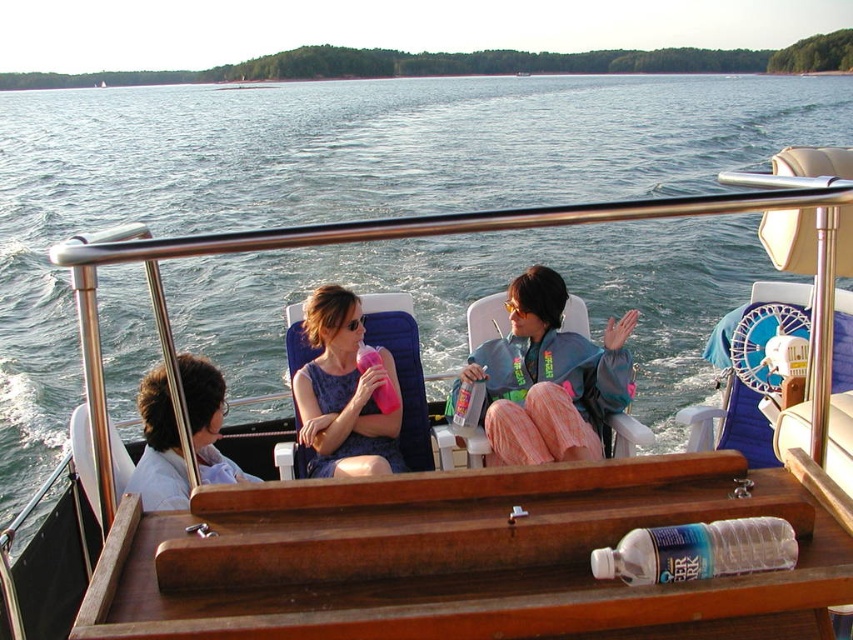
Can you confirm if pink fabric pants at center is taller than light blue shirt at center?

Yes, pink fabric pants at center is taller than light blue shirt at center.

Is pink fabric pants at center above light blue shirt at center?

Yes.

Is point (590, 449) less distant than point (201, 444)?

No, it is behind (201, 444).

This screenshot has width=853, height=640. I want to click on pink fabric pants at center, so click(x=547, y=378).

Can you confirm if matte purple dress at center is positioned to the right of light blue shirt at center?

Correct, you'll find matte purple dress at center to the right of light blue shirt at center.

Is the position of matte purple dress at center more distant than that of light blue shirt at center?

That is True.

Does point (322, 368) come farther from viewer compared to point (138, 392)?

Yes, point (322, 368) is farther from viewer.

This screenshot has width=853, height=640. Identify the location of matte purple dress at center. (344, 392).

Is point (463, 384) closer to viewer compared to point (352, 368)?

Yes, point (463, 384) is closer to viewer.

Who is taller, pink fabric pants at center or matte purple dress at center?

With more height is pink fabric pants at center.

Which is behind, point (611, 326) or point (386, 376)?

Positioned behind is point (611, 326).

Where is `pink fabric pants at center`? pink fabric pants at center is located at coordinates (547, 378).